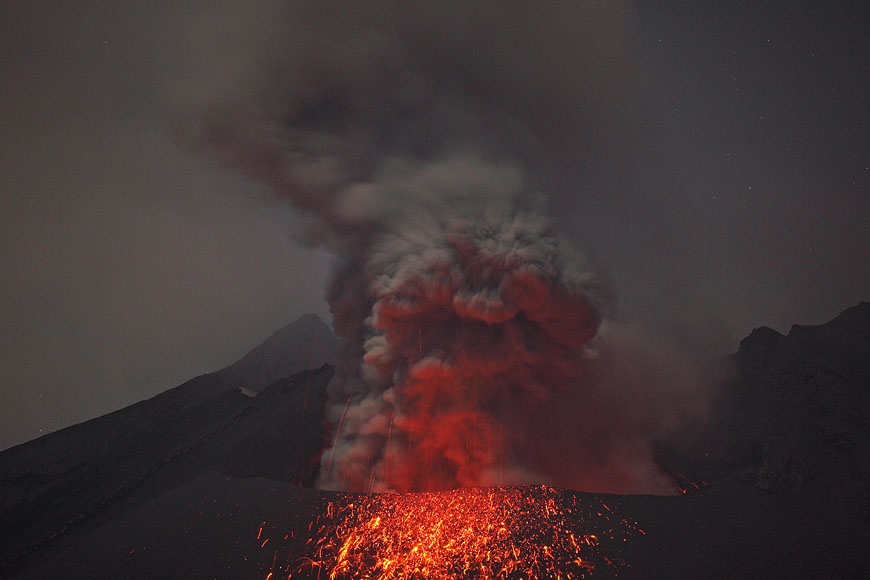
Locate an element on the screen. The width and height of the screenshot is (870, 580). yellow light is located at coordinates (371, 525).